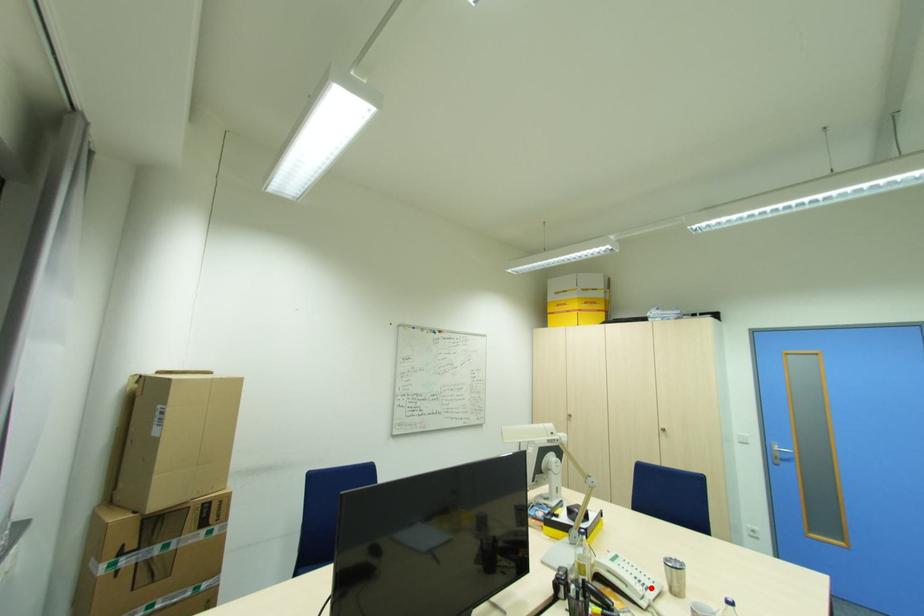
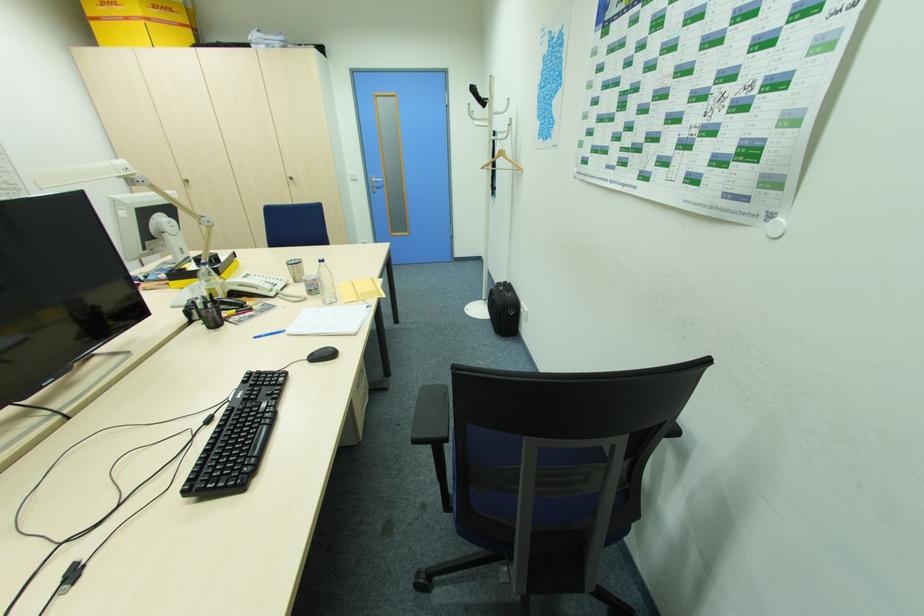
Where in the second image is the point corresponding to the highlighted location from the first image?

(280, 285)